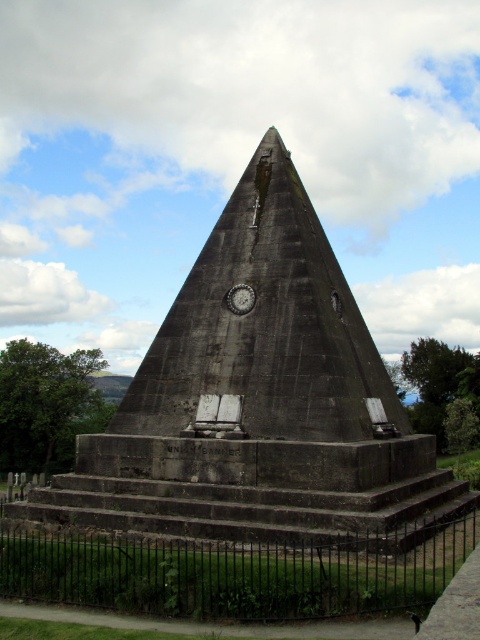
Can you confirm if dark gray stone monument at center is smaller than black wrought iron fence at lower center?

No, dark gray stone monument at center is not smaller than black wrought iron fence at lower center.

Where is `dark gray stone monument at center`? This screenshot has height=640, width=480. dark gray stone monument at center is located at coordinates (256, 401).